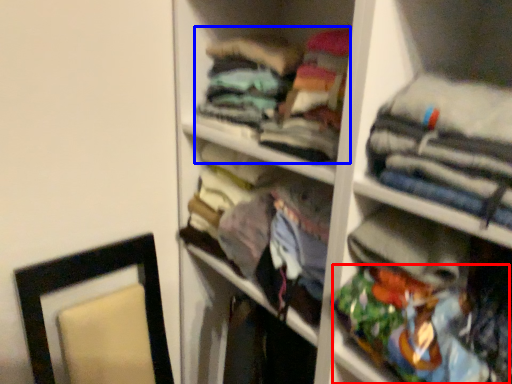
Question: Which point is further to the camera, clothing (highlighted by a red box) or clothing (highlighted by a blue box)?

Choices:
 (A) clothing
 (B) clothing

Answer: (B)